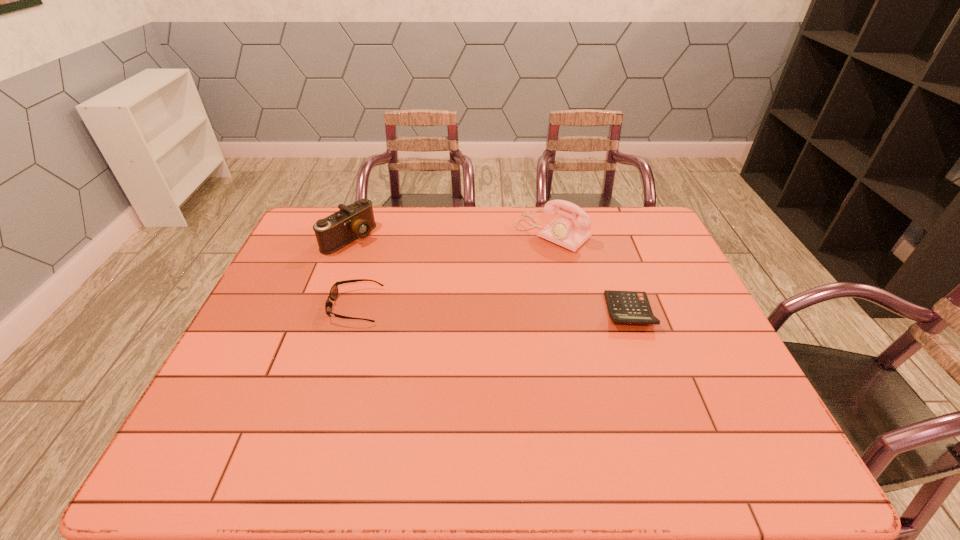
This screenshot has height=540, width=960. I want to click on free spot on the desktop that is between the sunglasses and the calculator and is positioned on the dial of the tallest object, so click(467, 308).

You are a GUI agent. You are given a task and a screenshot of the screen. Output one action in this format:
    pyautogui.click(x=<x>, y=<y>)
    Task: Click on the free spot on the desktop that is between the sunglasses and the calculator and is positioned on the lens of the camera
    
    Given the screenshot: What is the action you would take?
    pyautogui.click(x=478, y=308)